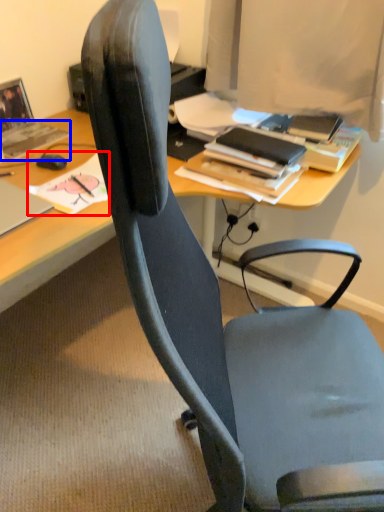
Question: Among these objects, which one is nearest to the camera, book (highlighted by a red box) or book (highlighted by a blue box)?

Choices:
 (A) book
 (B) book

Answer: (A)